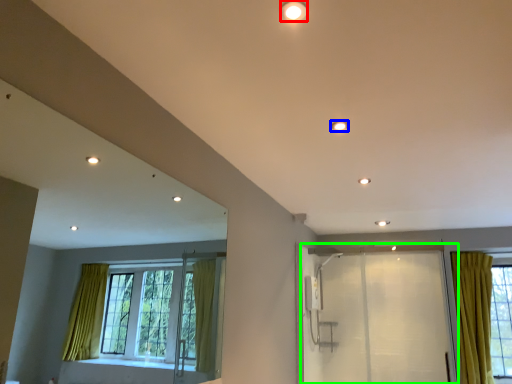
Question: Estimate the real-world distances between objects in this image. Which object is closer to lighting (highlighted by a red box), lighting (highlighted by a blue box) or screen door (highlighted by a green box)?

Choices:
 (A) lighting
 (B) screen door

Answer: (A)